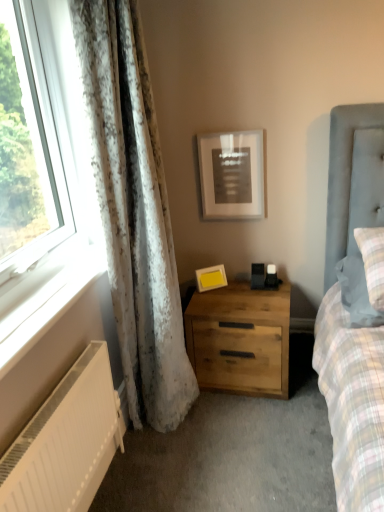
Question: Based on their positions, is white painted wood at lower left located to the left or right of white textured curtain at left?

Choices:
 (A) left
 (B) right

Answer: (A)

Question: Is white painted wood at lower left taller or shorter than white textured curtain at left?

Choices:
 (A) tall
 (B) short

Answer: (B)

Question: Considering the real-world distances, which object is farthest from the white matte radiator at lower left?

Choices:
 (A) white painted wood at lower left
 (B) plaid fabric pillow at right
 (C) yellow matte picture frame at upper center, the 1th picture frame positioned from the bottom
 (D) matte black picture frame at upper center, the second picture frame ordered from the bottom
 (E) white textured curtain at left

Answer: (D)

Question: Estimate the real-world distances between objects in this image. Which object is closer to the white painted wood at lower left?

Choices:
 (A) white matte radiator at lower left
 (B) yellow matte picture frame at upper center, the 2th picture frame when ordered from top to bottom
 (C) white textured curtain at left
 (D) natural wood nightstand at center
 (E) plaid fabric pillow at right

Answer: (A)